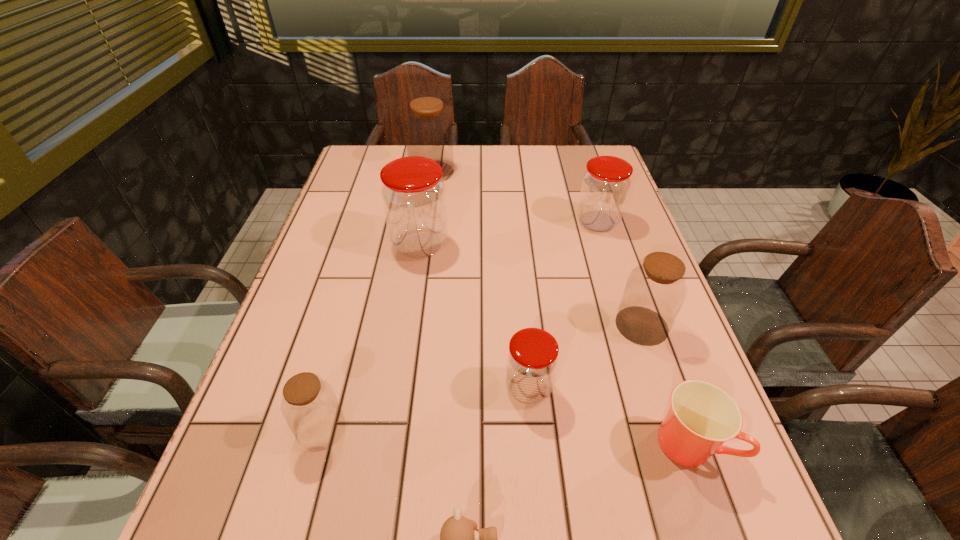
This screenshot has height=540, width=960. Find the location of `cup`. cup is located at coordinates (702, 416).

Find the location of `vacant space located 0.230m on the front of the biggest brown jar`. vacant space located 0.230m on the front of the biggest brown jar is located at coordinates (423, 229).

The width and height of the screenshot is (960, 540). I want to click on vacant space located on the back of the leftmost red jar, so click(430, 179).

Locate an element on the screen. The height and width of the screenshot is (540, 960). vacant space located on the left of the rightmost red jar is located at coordinates (529, 222).

Where is `vacant point located on the front of the rightmost brown jar`? vacant point located on the front of the rightmost brown jar is located at coordinates (682, 442).

Where is `free space located on the back of the nearest brown jar`? The image size is (960, 540). free space located on the back of the nearest brown jar is located at coordinates (352, 318).

Find the location of a particular element. vacant position located on the left of the second red jar from right to left is located at coordinates (458, 388).

Where is `free space located on the left of the cup`? This screenshot has width=960, height=540. free space located on the left of the cup is located at coordinates (431, 443).

What are the coordinates of `object located at the far edge` in the screenshot? It's located at (428, 131).

Find the location of a particular element. Image resolution: width=960 pixels, height=540 pixels. object present at the left edge is located at coordinates (309, 405).